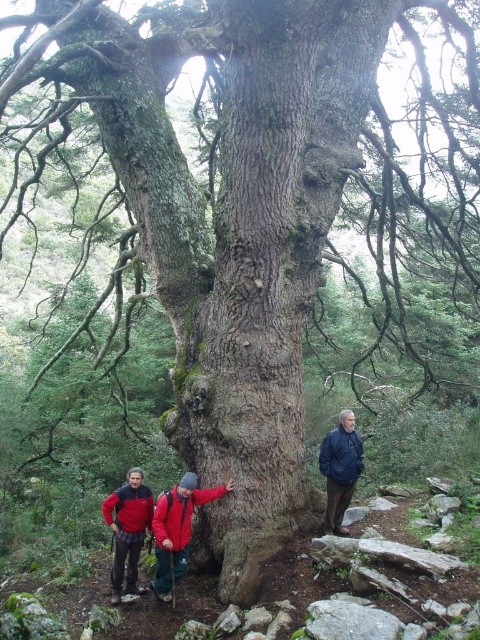
Who is more forward, (149, 584) or (151, 531)?

Point (149, 584) is in front.

In the scene shown: Which is more to the left, red fleece jackets at lower center or red fleece jacket at lower left?

red fleece jacket at lower left is more to the left.

Between point (178, 508) and point (141, 593), which one is positioned in front?

Point (178, 508)

What are the coordinates of `red fleece jackets at lower center` in the screenshot? It's located at tap(177, 529).

Which is more to the right, red fleece jackets at lower center or blue jacket at center?

blue jacket at center is more to the right.

Is red fleece jackets at lower center positioned behind blue jacket at center?

That is False.

Which is behind, point (124, 532) or point (328, 458)?

The point (328, 458) is behind.

At what (x,y) coordinates should I click in order to perform the action: click on red fleece jackets at lower center. Please return your answer as a coordinate pair (x, y). This screenshot has height=640, width=480. Looking at the image, I should click on (177, 529).

Is point (136, 552) more distant than point (333, 476)?

Yes, point (136, 552) is farther from viewer.

Is point (149, 516) less distant than point (344, 460)?

No, (149, 516) is behind (344, 460).

This screenshot has height=640, width=480. What are the coordinates of `red fleece jacket at lower left` in the screenshot? It's located at (128, 531).